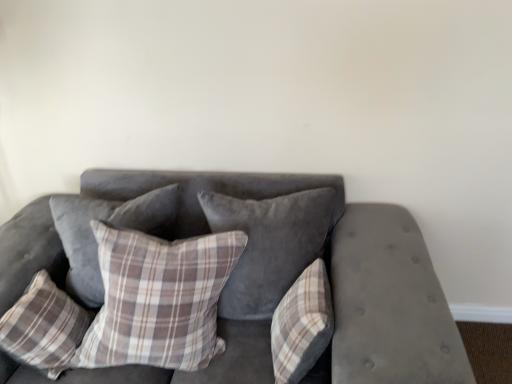
Question: Which direction should I rotate to look at plaid fabric pillow at center, which is the second pillow from left to right, — up or down?

Choices:
 (A) up
 (B) down

Answer: (B)

Question: Is plaid fabric pillow at center, positioned as the 1th pillow in right-to-left order, beside velvet gray couch at center?

Choices:
 (A) yes
 (B) no

Answer: (B)

Question: Considering the relative sizes of plaid fabric pillow at center, the fifth pillow positioned from the left, and velvet gray couch at center in the image provided, is plaid fabric pillow at center, the fifth pillow positioned from the left, thinner than velvet gray couch at center?

Choices:
 (A) no
 (B) yes

Answer: (B)

Question: Does plaid fabric pillow at center, positioned as the 1th pillow in right-to-left order, have a lesser height compared to velvet gray couch at center?

Choices:
 (A) yes
 (B) no

Answer: (A)

Question: Is plaid fabric pillow at center, the fifth pillow positioned from the left, to the left of velvet gray couch at center from the viewer's perspective?

Choices:
 (A) yes
 (B) no

Answer: (B)

Question: Does plaid fabric pillow at center, the fifth pillow positioned from the left, turn towards velvet gray couch at center?

Choices:
 (A) no
 (B) yes

Answer: (B)

Question: Is plaid fabric pillow at center, positioned as the 1th pillow in right-to-left order, taller than velvet gray couch at center?

Choices:
 (A) yes
 (B) no

Answer: (B)

Question: Does plaid fabric pillow at center, which appears as the 3th pillow when viewed from the left, have a greater width compared to velvet gray pillow at center, the 2th pillow in the right-to-left sequence?

Choices:
 (A) yes
 (B) no

Answer: (B)

Question: From the image's perspective, is plaid fabric pillow at center, which is counted as the 3th pillow, starting from the right, located above velvet gray pillow at center, the 2th pillow in the right-to-left sequence?

Choices:
 (A) yes
 (B) no

Answer: (B)

Question: Can you confirm if plaid fabric pillow at center, which appears as the 3th pillow when viewed from the left, is bigger than velvet gray pillow at center, the 2th pillow in the right-to-left sequence?

Choices:
 (A) no
 (B) yes

Answer: (B)

Question: Is the position of plaid fabric pillow at center, which is counted as the 3th pillow, starting from the right, less distant than that of velvet gray pillow at center, which is the fourth pillow from left to right?

Choices:
 (A) yes
 (B) no

Answer: (A)

Question: Is plaid fabric pillow at center, which is counted as the 3th pillow, starting from the right, taller than velvet gray pillow at center, the 2th pillow in the right-to-left sequence?

Choices:
 (A) no
 (B) yes

Answer: (B)

Question: Is plaid fabric pillow at center, which appears as the 3th pillow when viewed from the left, shorter than velvet gray pillow at center, the 2th pillow in the right-to-left sequence?

Choices:
 (A) yes
 (B) no

Answer: (B)

Question: From the image's perspective, would you say plaid fabric pillow at center, which appears as the 3th pillow when viewed from the left, is shown under velvet gray couch at center?

Choices:
 (A) yes
 (B) no

Answer: (B)